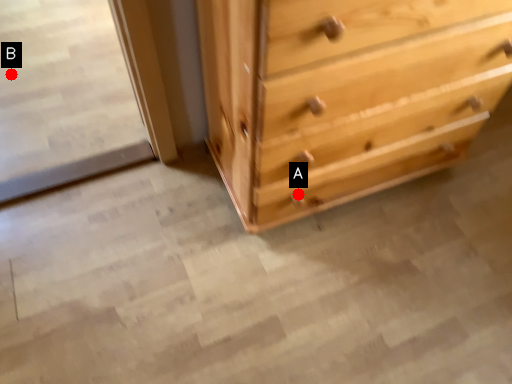
Question: Two points are circled on the image, labeled by A and B beside each circle. Which of the following is the farthest from the observer?

Choices:
 (A) A is further
 (B) B is further

Answer: (B)